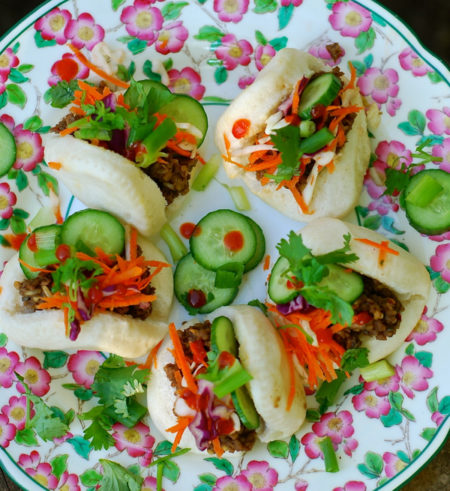
Find the location of a particular element. This screenshot has height=491, width=450. table is located at coordinates (432, 476).